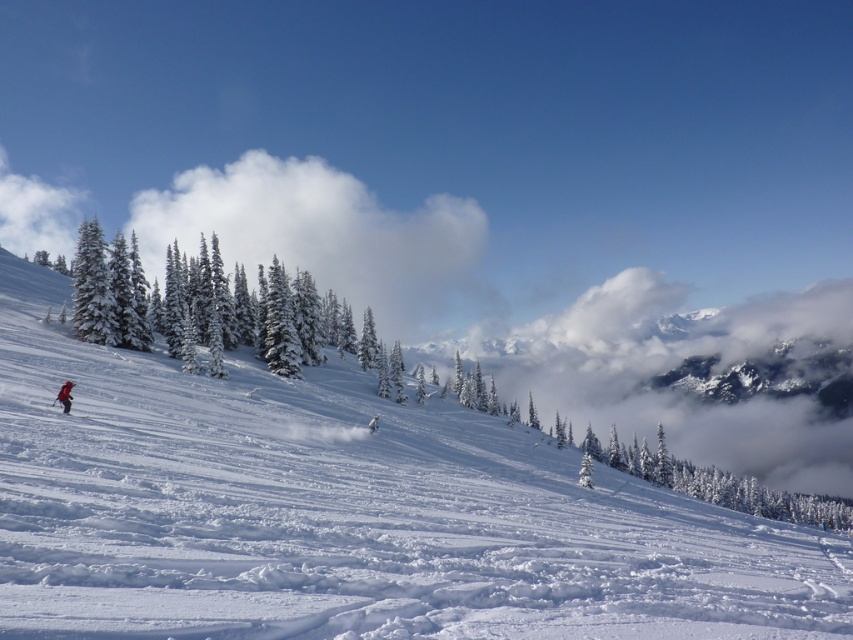
Question: Does white fluffy cloud at upper center appear on the right side of red fabric backpack at lower left?

Choices:
 (A) no
 (B) yes

Answer: (A)

Question: Among these points, which one is farthest from the camera?

Choices:
 (A) (616, 483)
 (B) (67, 406)
 (C) (61, 394)
 (D) (383, 285)

Answer: (D)

Question: Considering the relative positions of white powdery snow at lower left and black matte ski at lower left in the image provided, where is white powdery snow at lower left located with respect to black matte ski at lower left?

Choices:
 (A) above
 (B) below

Answer: (A)

Question: Which is nearer to the black matte ski at lower left?

Choices:
 (A) red fabric backpack at lower left
 (B) white fluffy cloud at upper center
 (C) white powdery snow at lower left

Answer: (A)

Question: Which object appears farthest from the camera in this image?

Choices:
 (A) black matte ski at lower left
 (B) red fabric backpack at lower left
 (C) white powdery snow at lower left

Answer: (B)

Question: Does white powdery snow at lower left come in front of red fabric backpack at lower left?

Choices:
 (A) yes
 (B) no

Answer: (A)